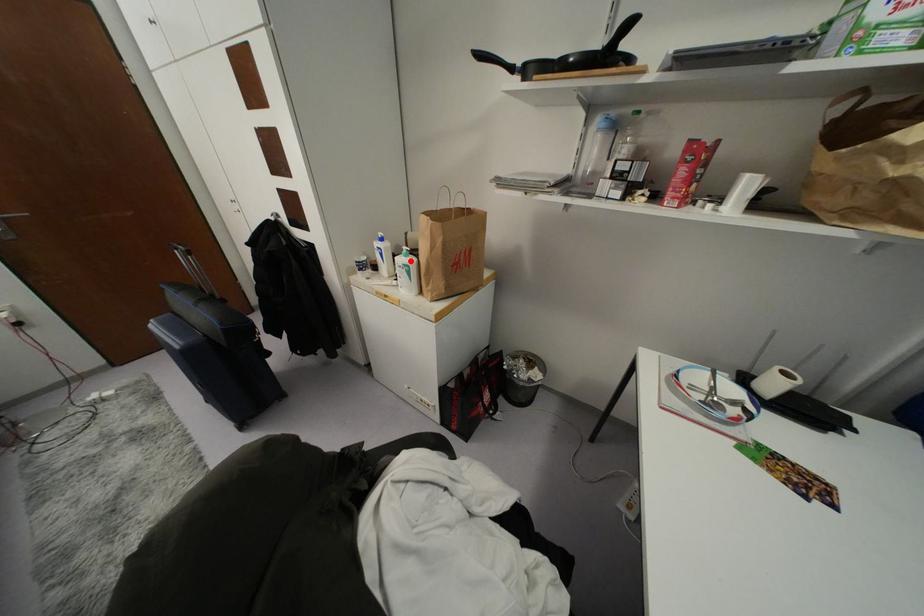
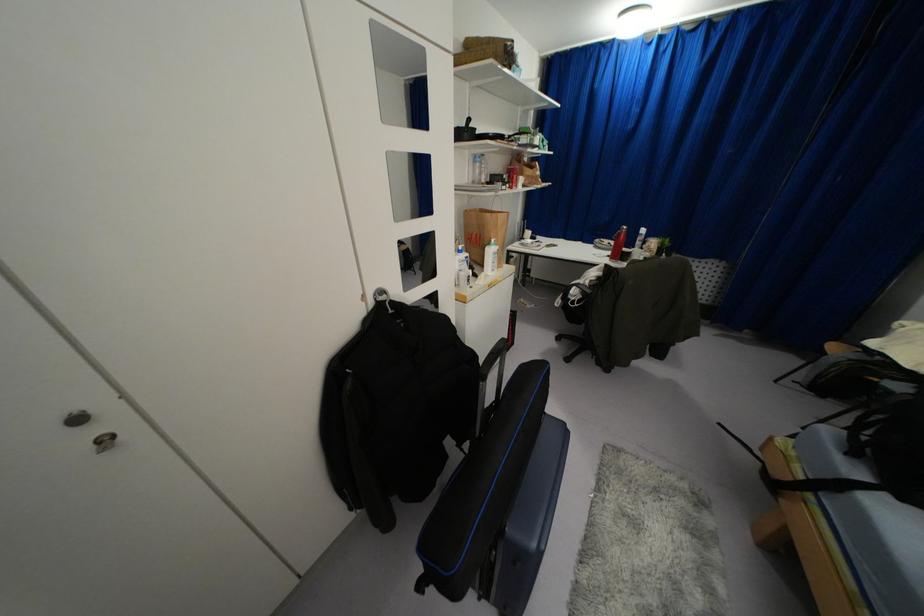
In the second image, find the point that corresponds to the highlighted location in the first image.

(495, 246)